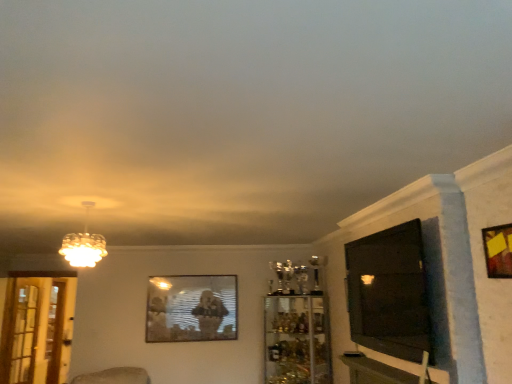
Question: Is clear glass cabinet at center taller or shorter than wooden table at lower right?

Choices:
 (A) short
 (B) tall

Answer: (B)

Question: Considering the positions of point (309, 302) and point (401, 382), is point (309, 302) closer or farther from the camera than point (401, 382)?

Choices:
 (A) closer
 (B) farther

Answer: (B)

Question: Which is nearer to the matte glass chandelier at upper left?

Choices:
 (A) clear glass screen door at left, positioned as the 1th screen door in right-to-left order
 (B) clear glass cabinet at center
 (C) wooden frame at upper right, the first picture frame from the top
 (D) black glossy tv at right
 (E) wooden table at lower right

Answer: (D)

Question: Which of these objects is positioned closest to the black glossy tv at right?

Choices:
 (A) clear glass cabinet at center
 (B) clear glass screen door at left, acting as the second screen door starting from the back
 (C) wooden screen door at left, marked as the 1th screen door in a left-to-right arrangement
 (D) wooden table at lower right
 (E) matte glass chandelier at upper left

Answer: (D)